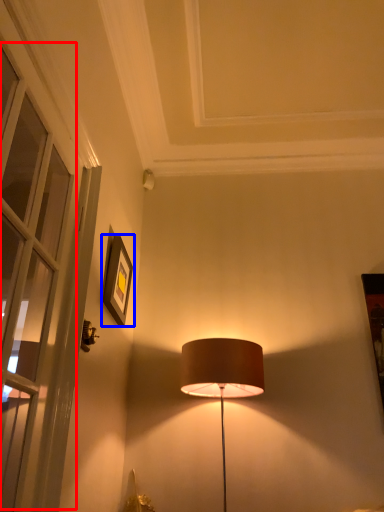
Question: Which object is closer to the camera taking this photo, window (highlighted by a red box) or picture frame (highlighted by a blue box)?

Choices:
 (A) window
 (B) picture frame

Answer: (A)